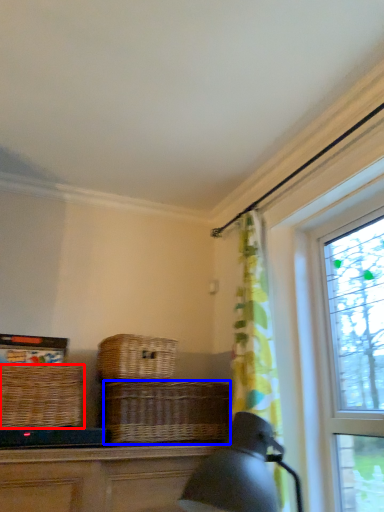
Question: Which point is closer to the camera, picnic basket (highlighted by a red box) or basket (highlighted by a blue box)?

Choices:
 (A) picnic basket
 (B) basket

Answer: (A)